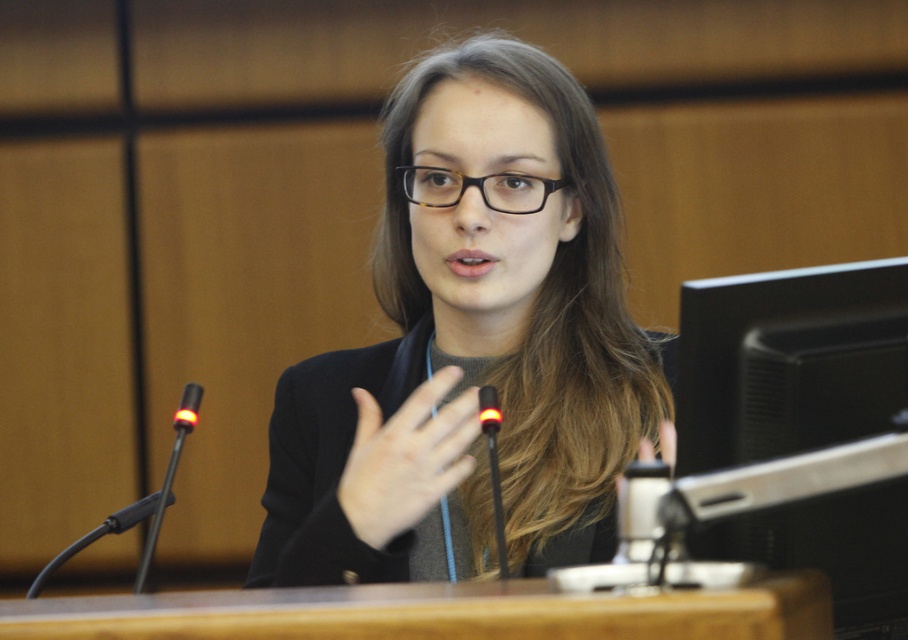
You are standing in front of a conference desk with two microphones lit up. There is a point marked at coordinates [743,412] on the desk. If you want to place a 12 inch long document on the desk without covering this point, where should you position it?

The point at [743,412] is 38.98 inches away from the viewer. To place a 12 inch document without covering it, position the document at least 12 inches away from the point in any direction, ensuring there is space between them.

You are a sound technician in a conference room. You need to adjust the height of the microphones to ensure proper audio pickup. Which microphone, the black plastic microphone at left or the black plastic microphone at center, requires more height adjustment to reach the speaker?

The black plastic microphone at left requires more height adjustment because it is shorter than the black plastic microphone at center.